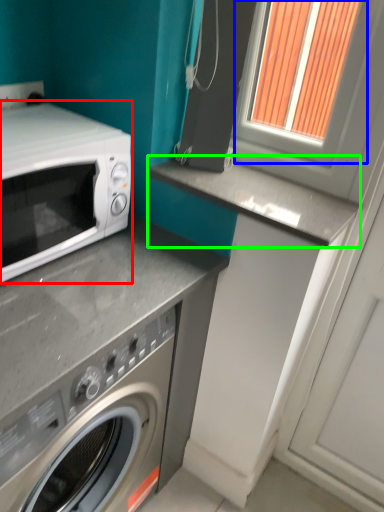
Question: Considering the real-world distances, which object is farthest from microwave oven (highlighted by a red box)? window frame (highlighted by a blue box) or counter top (highlighted by a green box)?

Choices:
 (A) window frame
 (B) counter top

Answer: (A)